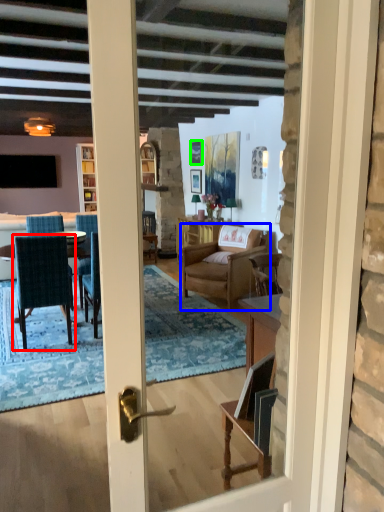
Question: Estimate the real-world distances between objects in this image. Which object is closer to chair (highlighted by a red box), chair (highlighted by a blue box) or picture frame (highlighted by a green box)?

Choices:
 (A) chair
 (B) picture frame

Answer: (A)